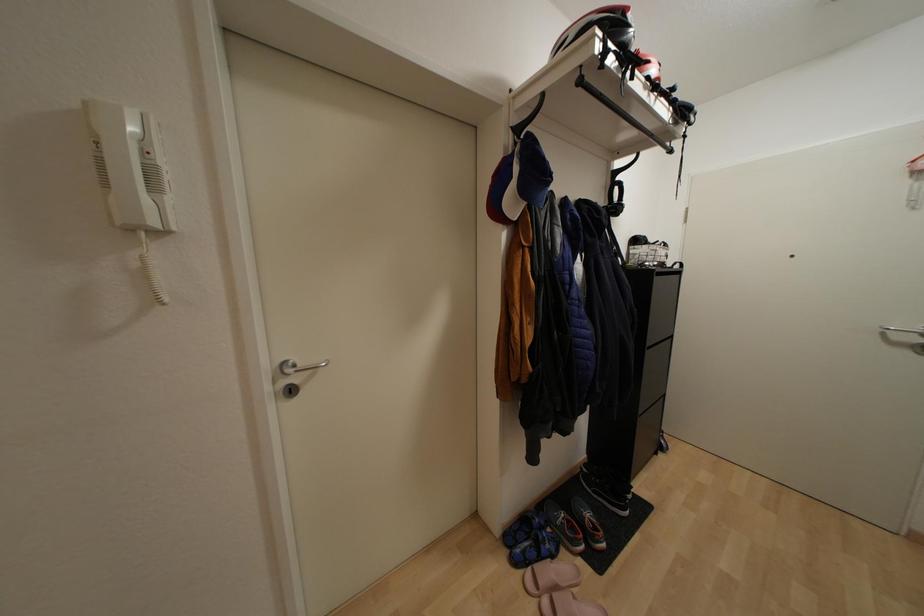
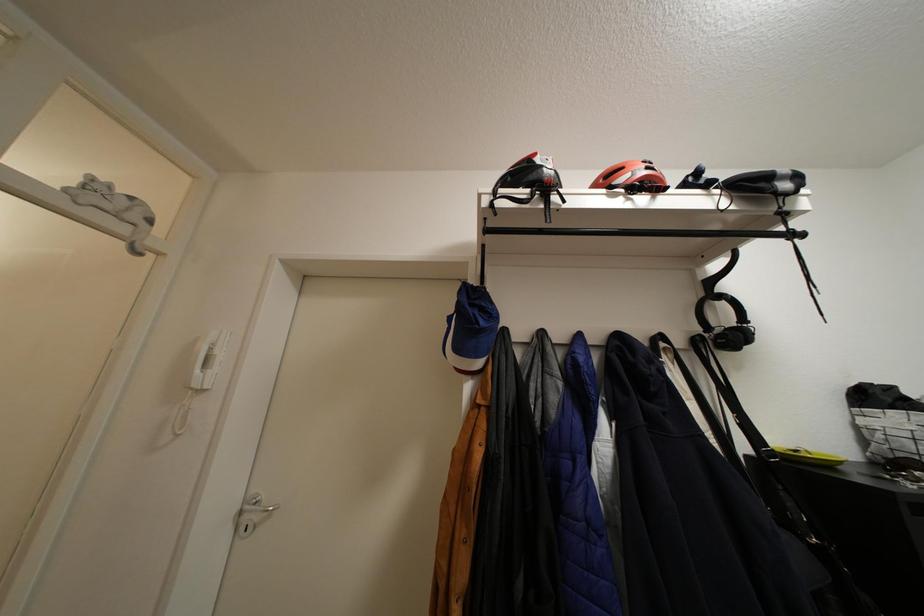
The images are taken continuously from a first-person perspective. In which direction is your viewpoint rotating?

→ The camera rotated toward left-up.